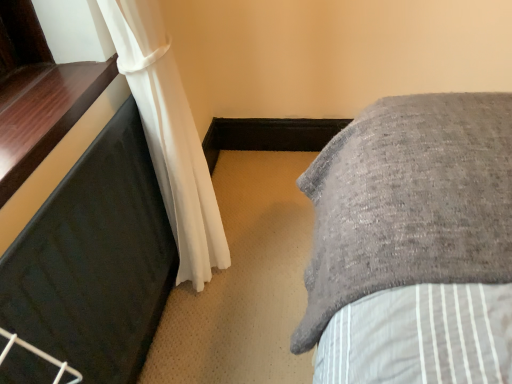
I want to click on vacant space to the right of white sheer curtain at left, so click(x=271, y=243).